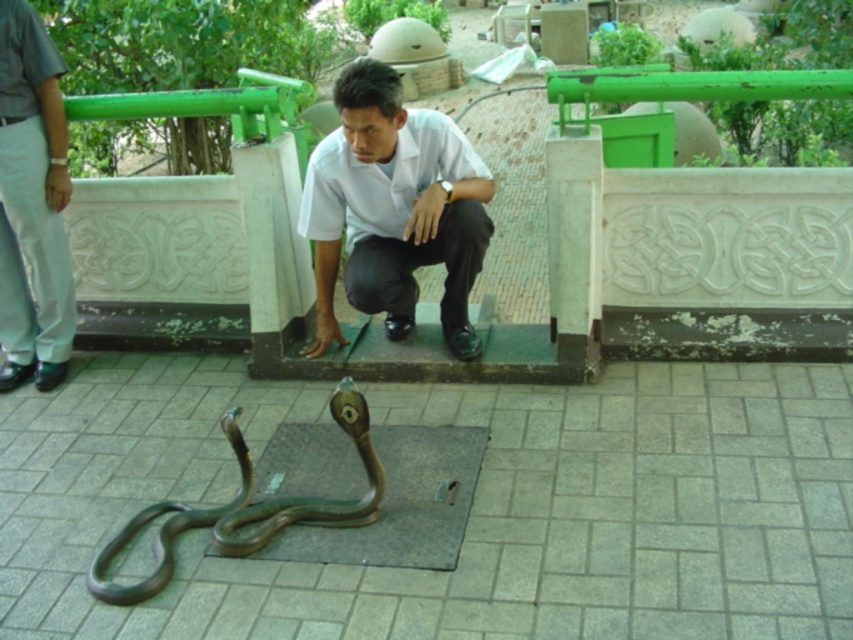
Is gray cotton pants at left shorter than shiny bronze snake at lower center?

No.

Is gray cotton pants at left to the left of shiny bronze snake at lower center from the viewer's perspective?

Correct, you'll find gray cotton pants at left to the left of shiny bronze snake at lower center.

Which is in front, point (47, 196) or point (345, 406)?

Point (345, 406)

You are a GUI agent. You are given a task and a screenshot of the screen. Output one action in this format:
    pyautogui.click(x=<x>, y=<y>)
    Task: Click on the gray cotton pants at left
    The image size is (853, 640).
    Given the screenshot: What is the action you would take?
    pyautogui.click(x=32, y=204)

Does point (329, 288) come closer to viewer compared to point (241, 536)?

No, (329, 288) is behind (241, 536).

Is the position of white smooth shirt at center less distant than that of shiny bronze snake at lower center?

No, it is not.

Is point (379, 221) farther from camera compared to point (344, 515)?

Yes, point (379, 221) is farther from viewer.

This screenshot has width=853, height=640. Identify the location of white smooth shirt at center. (393, 209).

Which is more to the left, white smooth shirt at center or gray cotton pants at left?

From the viewer's perspective, gray cotton pants at left appears more on the left side.

Find the location of `white smooth shirt at center`. white smooth shirt at center is located at coordinates [x=393, y=209].

Locate an element on the screen. white smooth shirt at center is located at coordinates coord(393,209).